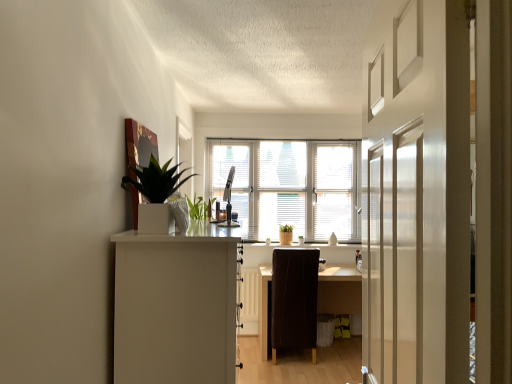
Question: From a real-world perspective, is white glossy planter at upper left physically located above or below white matte cabinet at left?

Choices:
 (A) below
 (B) above

Answer: (B)

Question: Considering the positions of white glossy planter at upper left and white matte cabinet at left in the image, is white glossy planter at upper left taller or shorter than white matte cabinet at left?

Choices:
 (A) short
 (B) tall

Answer: (A)

Question: Which is nearer to the white glossy window sill at center?

Choices:
 (A) brown leather chair at center
 (B) dark brown wooden desk at center
 (C) white matte cabinet at left
 (D) white glossy planter at upper left
 (E) white glossy door at center

Answer: (B)

Question: Which object is the farthest from the white glossy planter at upper left?

Choices:
 (A) white glossy door at center
 (B) brown leather chair at center
 (C) white glossy window sill at center
 (D) white blinds at center
 (E) white matte cabinet at left

Answer: (C)